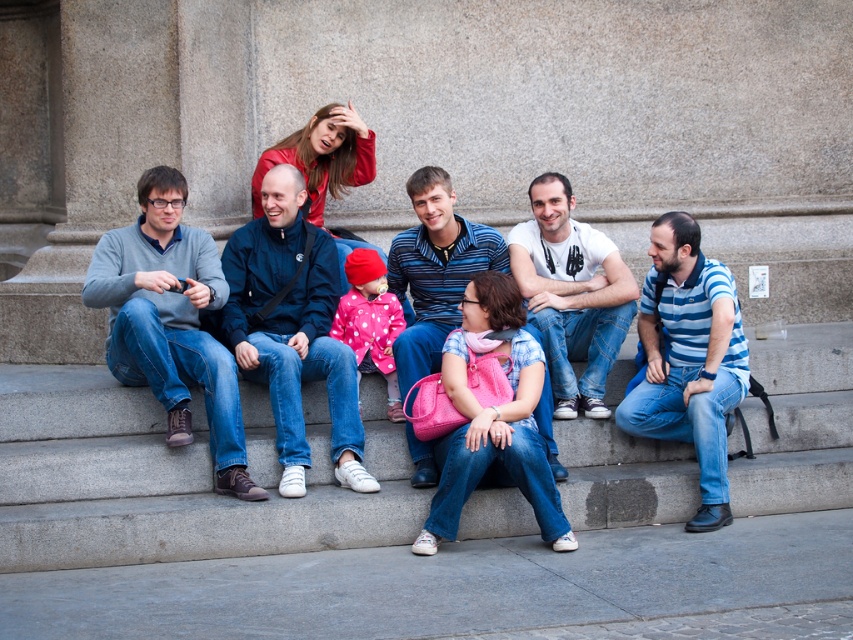
Question: Does white t-shirt at center have a greater width compared to matte pink coat at center?

Choices:
 (A) yes
 (B) no

Answer: (A)

Question: Which point is farther from the camera taking this photo?

Choices:
 (A) (325, 266)
 (B) (576, 337)
 (C) (376, 310)
 (D) (444, 509)

Answer: (B)

Question: Where is matte blue jeans at center located in relation to white t-shirt at center in the image?

Choices:
 (A) left
 (B) right

Answer: (A)

Question: Is blue striped polo shirt at center in front of matte pink coat at center?

Choices:
 (A) no
 (B) yes

Answer: (B)

Question: Which of these objects is positioned closest to the matte blue jeans at center?

Choices:
 (A) blue striped polo shirt at center
 (B) striped polo shirt at center

Answer: (B)

Question: Which point is closer to the camera taking this photo?

Choices:
 (A) (280, 170)
 (B) (621, 420)

Answer: (B)